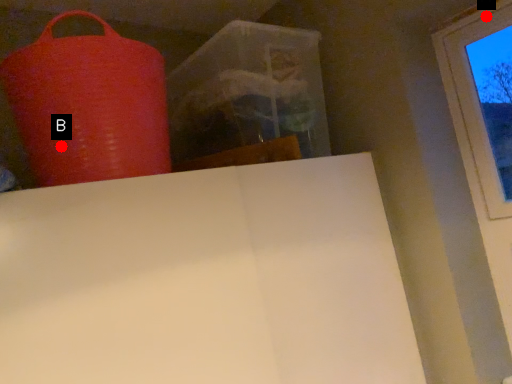
Question: Two points are circled on the image, labeled by A and B beside each circle. Among these points, which one is nearest to the camera?

Choices:
 (A) A is closer
 (B) B is closer

Answer: (B)